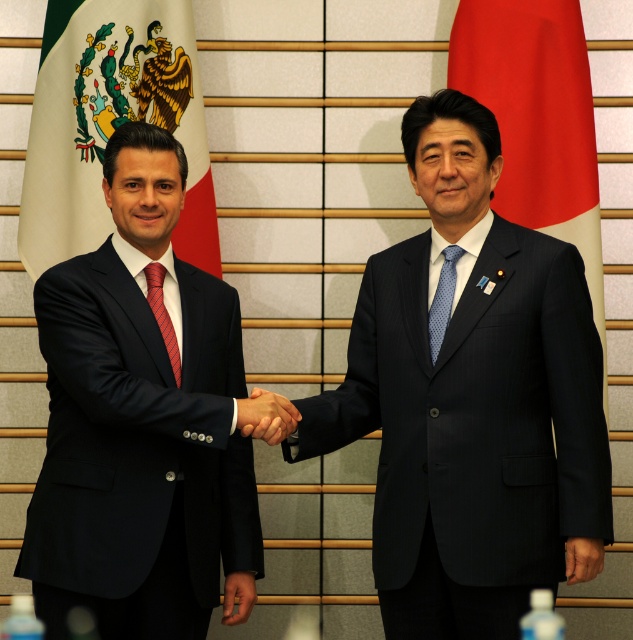
You are a photographer trying to capture a closeup of the dark blue pinstripe suit at center. Given that your camera has a fixed focus point at coordinate point (472,401), will this point help you focus on the dark blue pinstripe suit at center?

Yes, the point (472,401) corresponds to the dark blue pinstripe suit at center, so the fixed focus point will help you focus on it.

Based on the photo, you are attending a diplomatic event and notice two items in the scene. One is the white fabric flag at left and the other is the blue dotted tie at center. Based on their positions, which item is located to the east of the other?

The white fabric flag at left is to the left of the blue dotted tie at center, so the white fabric flag at left is located to the west of the blue dotted tie at center. Therefore, the blue dotted tie at center is to the east of the white fabric flag at left.

You are a photographer at a diplomatic event. You need to capture a closeup shot of the red silk tie at left without including the red fabric flag at right in the frame. Is this possible given their positions?

The red fabric flag at right is above the red silk tie at left, so it is possible to frame the shot to focus on the red silk tie at left while excluding the red fabric flag at right by adjusting the camera angle downward.